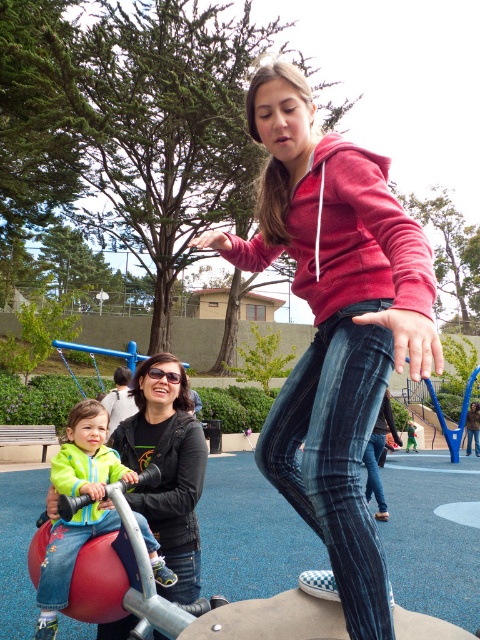
Based on the photo, you are a photographer trying to capture a clear shot of both the matte red hoodie at center and the green fleece jacket at center. Since you want both subjects in focus, which one should you adjust your camera focus on first?

You should focus on the matte red hoodie at center first because it is closer to the viewer than the green fleece jacket at center, ensuring both are in focus when using depth of field properly.

You are taking a photo of the playground scene. You notice two points in the image at coordinates point (402,240) and point (96,412). Which point will appear larger in your photo?

Point (402,240) is closer to the camera than point (96,412), so it will appear larger in the photo.